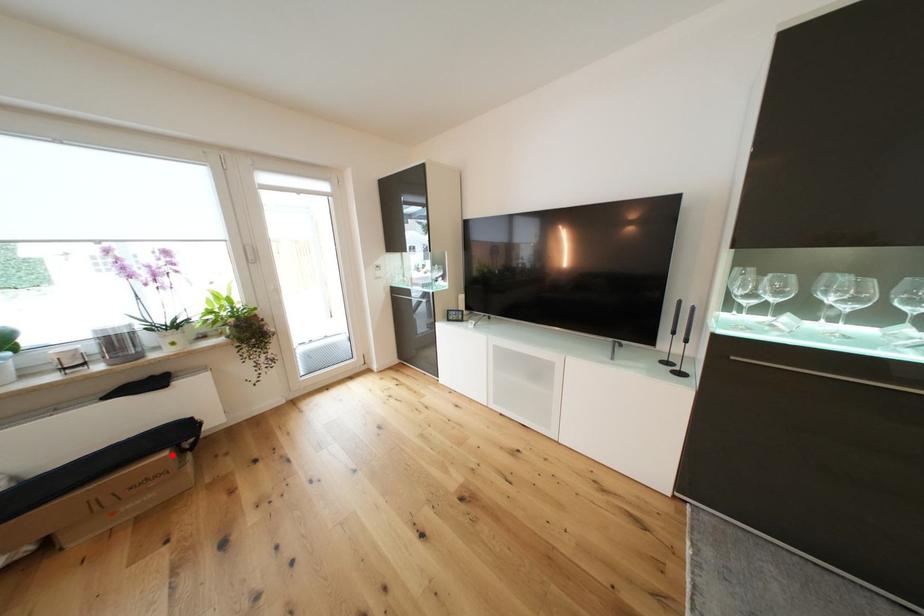
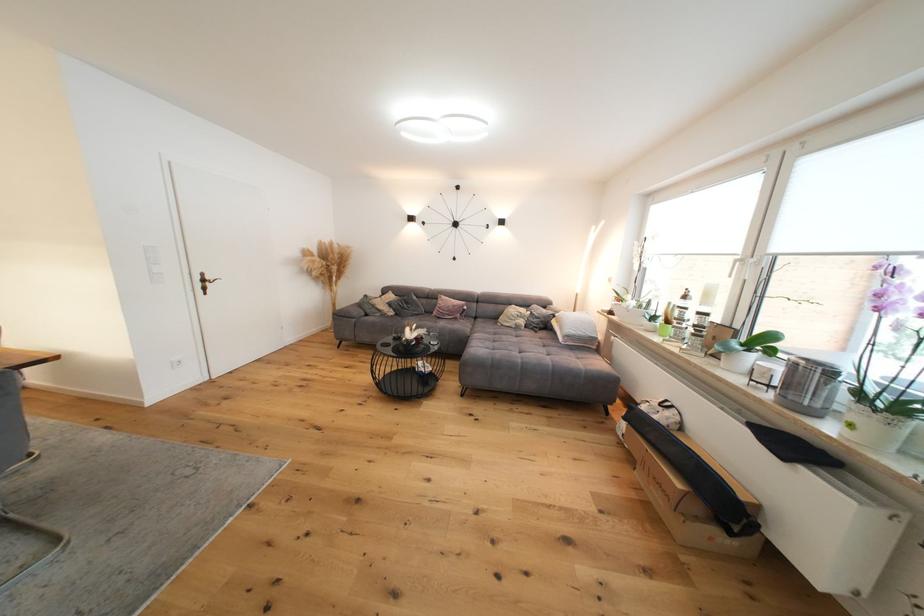
The point at the highlighted location is marked in the first image. Where is the corresponding point in the second image?

(687, 488)